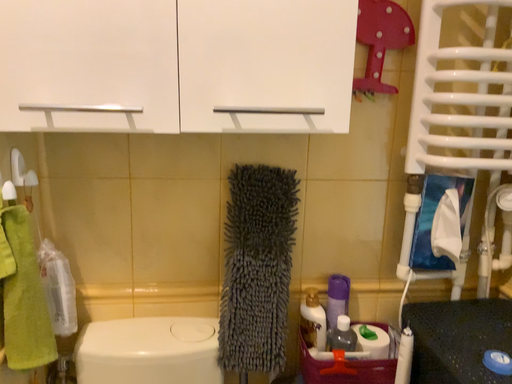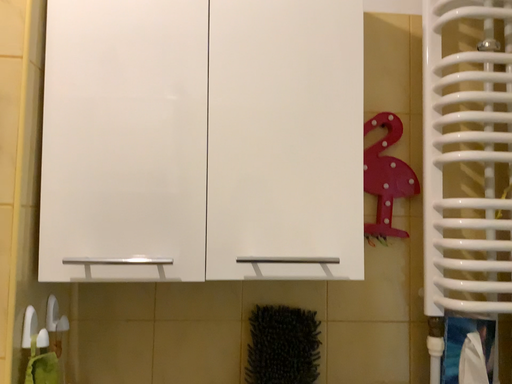
Question: How did the camera likely rotate when shooting the video?

Choices:
 (A) rotated downward
 (B) rotated upward

Answer: (B)